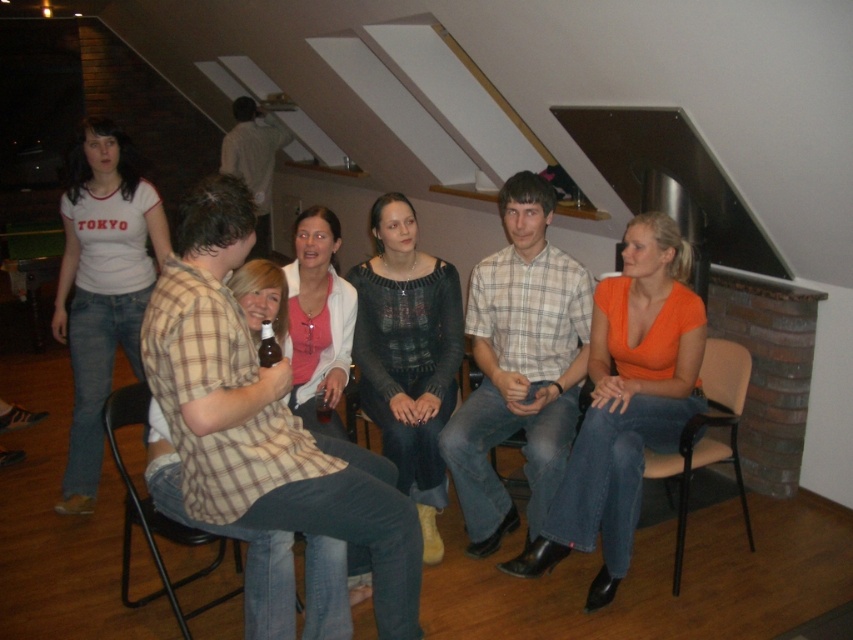
You are a GUI agent. You are given a task and a screenshot of the screen. Output one action in this format:
    pyautogui.click(x=<x>, y=<y>)
    Task: Click on the white matte shirt at left
    This screenshot has height=640, width=853.
    Given the screenshot: What is the action you would take?
    pyautogui.click(x=102, y=285)

Can you confirm if white matte shirt at left is positioned to the left of knitted sweater at center?

Yes, white matte shirt at left is to the left of knitted sweater at center.

The height and width of the screenshot is (640, 853). What do you see at coordinates (102, 285) in the screenshot?
I see `white matte shirt at left` at bounding box center [102, 285].

You are a GUI agent. You are given a task and a screenshot of the screen. Output one action in this format:
    pyautogui.click(x=<x>, y=<y>)
    Task: Click on the white matte shirt at left
    This screenshot has width=853, height=640.
    Given the screenshot: What is the action you would take?
    pyautogui.click(x=102, y=285)

Measure the distance between point (x=721, y=378) and camera.

Point (x=721, y=378) and camera are 9.84 feet apart.

Is beige fabric chair at lower right positioned in front of light brown shirt at upper center?

Yes, it is.

At what (x,y) coordinates should I click in order to perform the action: click on beige fabric chair at lower right. Please return your answer as a coordinate pair (x, y). This screenshot has width=853, height=640. Looking at the image, I should click on (706, 436).

Does point (608, 371) lie in front of point (515, 388)?

No, it is not.

Who is more distant from viewer, (653, 236) or (547, 492)?

The point (547, 492) is behind.

Between point (619, 460) and point (465, 404), which one is positioned in front?

Point (619, 460)

I want to click on orange matte shirt at center, so click(x=625, y=403).